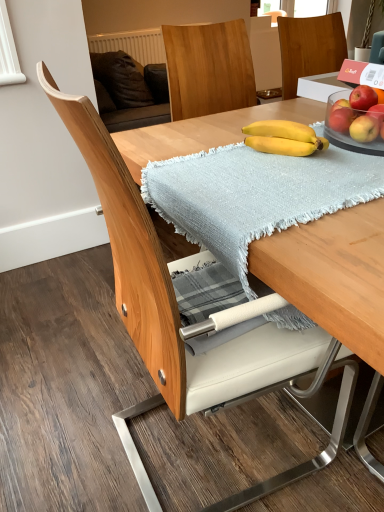
This screenshot has height=512, width=384. I want to click on free space in front of red matte apple at upper right, acting as the second apple starting from the bottom, so click(x=345, y=142).